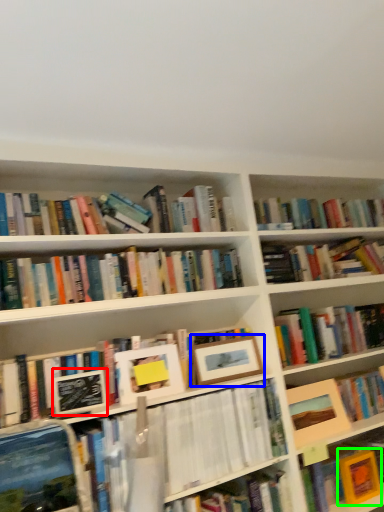
Question: Which object is positioned farthest from paperback book (highlighted by a red box)? Select from picture frame (highlighted by a blue box) and paperback book (highlighted by a green box).

Choices:
 (A) picture frame
 (B) paperback book

Answer: (B)